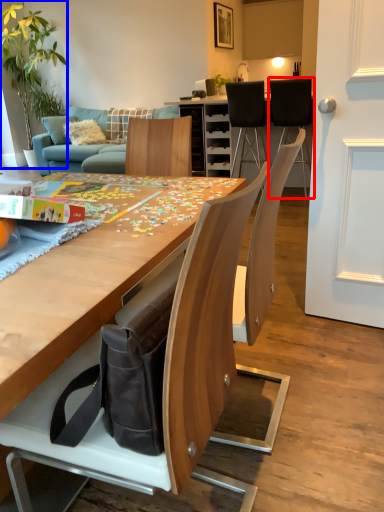
Question: Among these objects, which one is farthest to the camera, chair (highlighted by a red box) or houseplant (highlighted by a blue box)?

Choices:
 (A) chair
 (B) houseplant

Answer: (B)